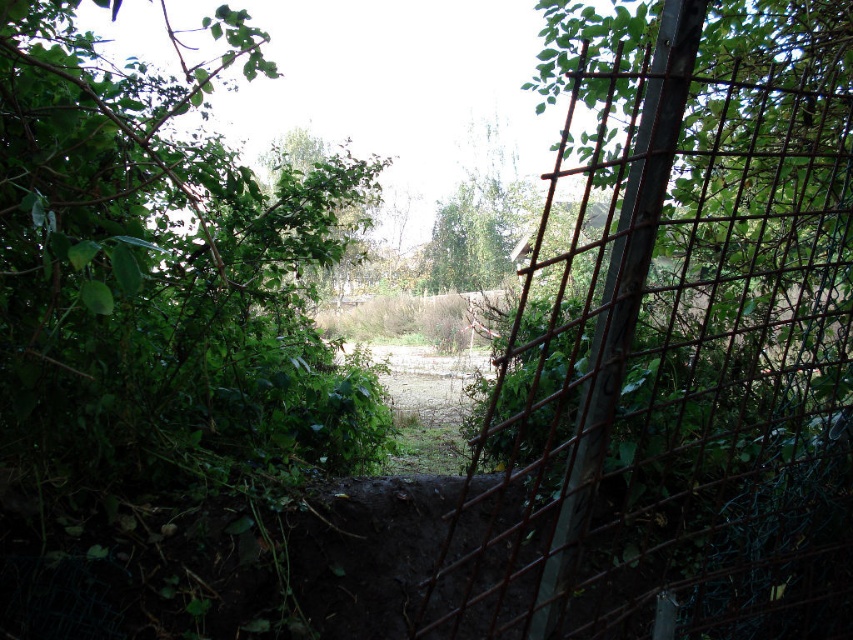
Does rusty metal trellis at center right have a larger size compared to green leafy tree at center?

Yes, rusty metal trellis at center right is bigger than green leafy tree at center.

Is rusty metal trellis at center right below green leafy tree at center?

Indeed, rusty metal trellis at center right is positioned under green leafy tree at center.

Who is more forward, (840,568) or (444,234)?

Point (840,568)

The image size is (853, 640). Identify the location of rusty metal trellis at center right. (672, 365).